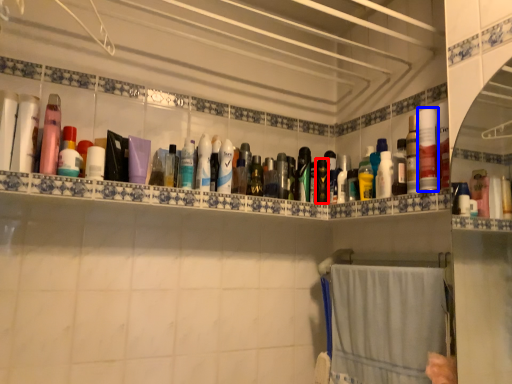
Question: Among these objects, which one is farthest to the camera, toiletry (highlighted by a red box) or toiletry (highlighted by a blue box)?

Choices:
 (A) toiletry
 (B) toiletry

Answer: (A)